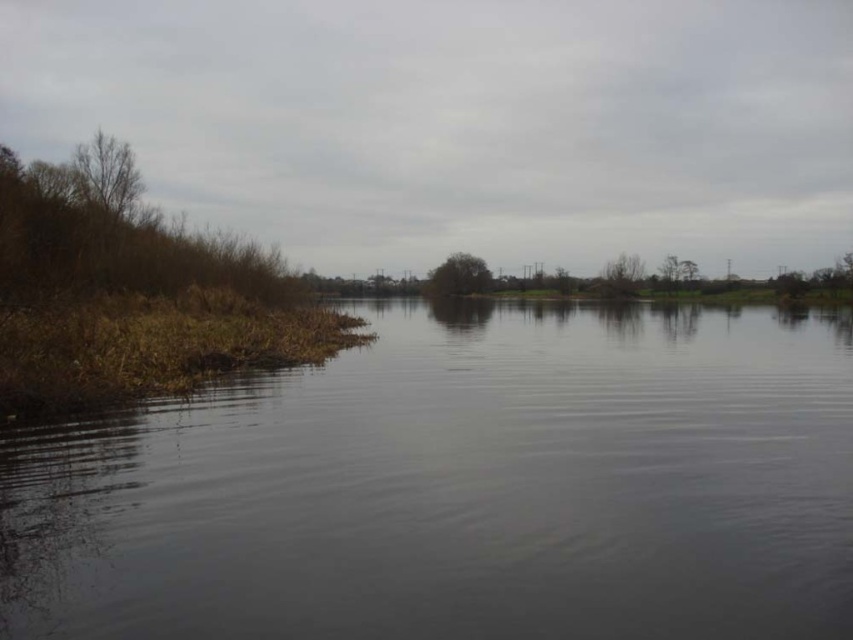
You are standing on the left riverbank and need to cross the river to the right bank. The dark water at center is in your path. Can you safely step over it? Please consider the water depth based on its position in the scene.

The dark water at center is located at point (x=460, y=486), which suggests it is deeper and more central in the river. Stepping over it might be risky due to its depth and central position in the river.

You are a bird looking for a nesting spot. You see the bare branches at left and the green matte tree at center. Which tree would you choose if you want to build a nest higher up?

The bare branches at left is much taller than the green matte tree at center, so you would choose the bare branches at left to build a nest higher up.